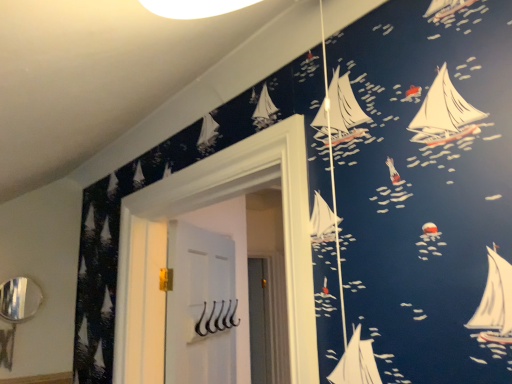
Question: Does white matte hooks at center have a lesser height compared to silver metallic mirror at lower left?

Choices:
 (A) yes
 (B) no

Answer: (B)

Question: Considering the relative positions of white matte hooks at center and silver metallic mirror at lower left in the image provided, is white matte hooks at center behind silver metallic mirror at lower left?

Choices:
 (A) yes
 (B) no

Answer: (B)

Question: Is white matte hooks at center looking in the opposite direction of silver metallic mirror at lower left?

Choices:
 (A) no
 (B) yes

Answer: (B)

Question: From a real-world perspective, is white matte hooks at center below silver metallic mirror at lower left?

Choices:
 (A) yes
 (B) no

Answer: (A)

Question: Considering the relative sizes of white matte hooks at center and silver metallic mirror at lower left in the image provided, is white matte hooks at center smaller than silver metallic mirror at lower left?

Choices:
 (A) yes
 (B) no

Answer: (B)

Question: Does white matte hooks at center come in front of silver metallic mirror at lower left?

Choices:
 (A) no
 (B) yes

Answer: (B)

Question: Is the depth of silver metallic mirror at lower left less than that of white matte hooks at center?

Choices:
 (A) no
 (B) yes

Answer: (A)

Question: Can white matte hooks at center be found inside silver metallic mirror at lower left?

Choices:
 (A) no
 (B) yes

Answer: (A)

Question: Can you confirm if silver metallic mirror at lower left is shorter than white matte hooks at center?

Choices:
 (A) yes
 (B) no

Answer: (A)

Question: Does silver metallic mirror at lower left lie behind white matte hooks at center?

Choices:
 (A) no
 (B) yes

Answer: (B)

Question: Are silver metallic mirror at lower left and white matte hooks at center far apart?

Choices:
 (A) yes
 (B) no

Answer: (B)

Question: Is silver metallic mirror at lower left beside white matte hooks at center?

Choices:
 (A) no
 (B) yes

Answer: (A)

Question: Would you say white matte hooks at center is to the left or to the right of silver metallic mirror at lower left in the picture?

Choices:
 (A) left
 (B) right

Answer: (B)